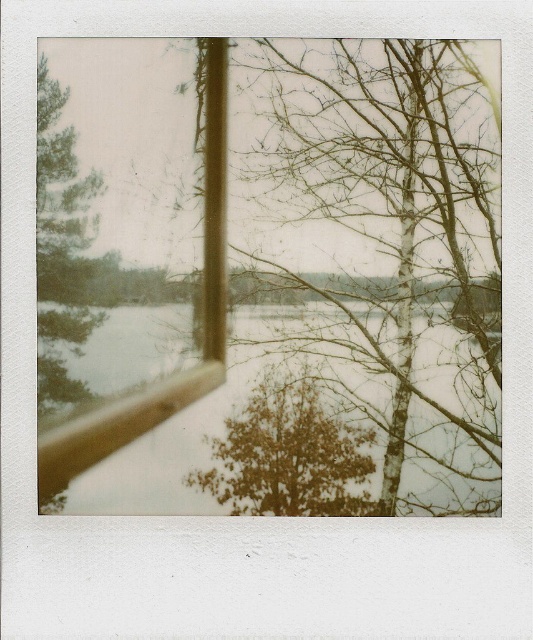
Question: Is bare wood tree at center positioned behind green matte tree at left?

Choices:
 (A) no
 (B) yes

Answer: (A)

Question: Based on their relative distances, which object is nearer to the brown textured tree at center?

Choices:
 (A) green matte tree at left
 (B) wooden frame at center
 (C) snowy water at center
 (D) bare wood tree at center

Answer: (C)

Question: Which of the following is the closest to the observer?

Choices:
 (A) bare wood tree at center
 (B) wooden frame at center
 (C) brown textured tree at center
 (D) snowy water at center

Answer: (A)

Question: Which of the following is the closest to the observer?

Choices:
 (A) brown textured tree at center
 (B) snowy water at center

Answer: (B)

Question: From the image, what is the correct spatial relationship of bare wood tree at center in relation to brown textured tree at center?

Choices:
 (A) left
 (B) right

Answer: (B)

Question: Observing the image, what is the correct spatial positioning of green matte tree at left in reference to wooden frame at center?

Choices:
 (A) right
 (B) left

Answer: (B)